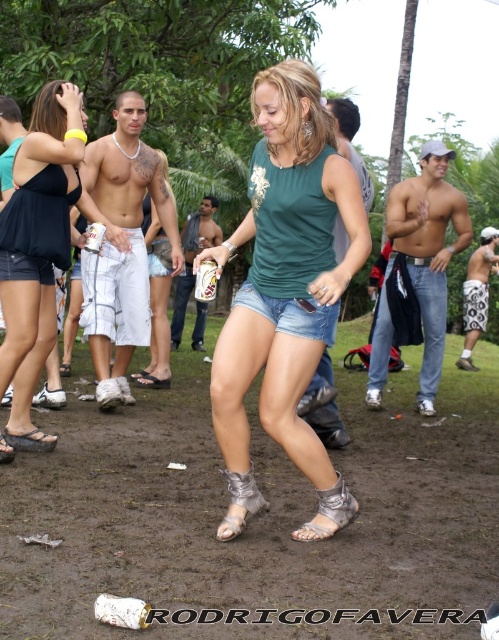
Does metallic silver can at center have a lesser height compared to white patterned shorts at right?

Incorrect, metallic silver can at center's height does not fall short of white patterned shorts at right's.

Between point (210, 237) and point (497, 253), which one is positioned behind?

Point (497, 253)

Where is `metallic silver can at center`? The width and height of the screenshot is (499, 640). metallic silver can at center is located at coordinates (193, 259).

Does matte black tank top at upper left have a greater width compared to muscular skin torso at center?

No, matte black tank top at upper left is not wider than muscular skin torso at center.

Is point (33, 433) farther from camera compared to point (410, 186)?

No, (33, 433) is closer to viewer.

Identify the location of matte black tank top at upper left. (36, 252).

Is white cotton shorts at center taller than matte white shorts at center?

Yes, white cotton shorts at center is taller than matte white shorts at center.

Is point (138, 108) in front of point (160, 310)?

Yes.

At what (x,y) coordinates should I click in order to perform the action: click on white cotton shorts at center. Please return your answer as a coordinate pair (x, y). The height and width of the screenshot is (640, 499). Looking at the image, I should click on click(120, 244).